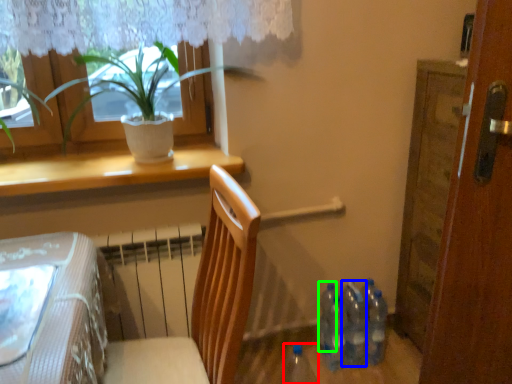
Question: Estimate the real-world distances between objects in this image. Which object is closer to bottle (highlighted by a red box), bottle (highlighted by a blue box) or bottle (highlighted by a green box)?

Choices:
 (A) bottle
 (B) bottle

Answer: (B)